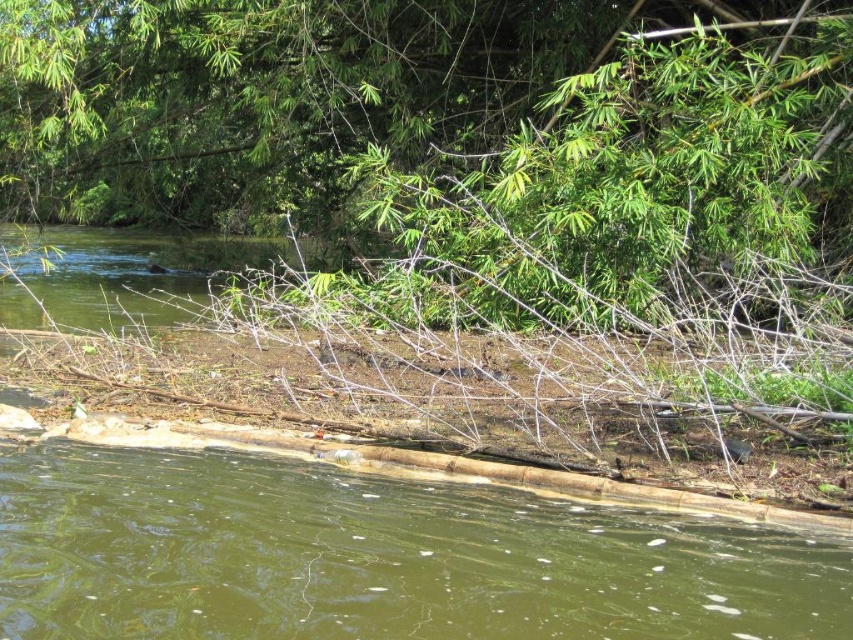
Question: Can you confirm if brown wood log at lower center is bigger than green leafy tree at upper center?

Choices:
 (A) yes
 (B) no

Answer: (B)

Question: Does green leafy tree at upper center come behind green leafy water at center?

Choices:
 (A) no
 (B) yes

Answer: (A)

Question: Which point appears farthest from the camera in this image?

Choices:
 (A) (3, 550)
 (B) (117, 92)

Answer: (B)

Question: Which of these objects is positioned farthest from the brown wood log at lower center?

Choices:
 (A) green leafy tree at upper center
 (B) green leafy water at center

Answer: (B)

Question: Does green leafy tree at upper center come in front of green leafy water at center?

Choices:
 (A) yes
 (B) no

Answer: (A)

Question: Which point appears closest to the camera in this image?

Choices:
 (A) 32,314
 (B) 148,109
 (C) 648,611

Answer: (C)